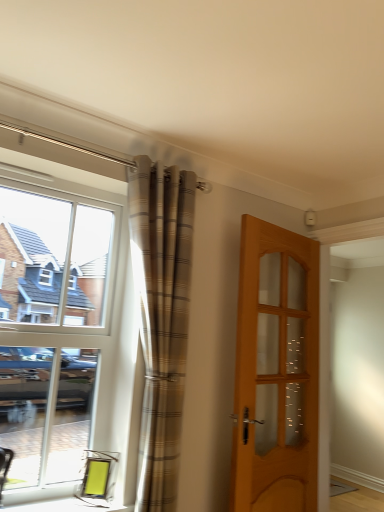
Question: From a real-world perspective, is plaid fabric curtain at left physically located above or below white glass window at left?

Choices:
 (A) below
 (B) above

Answer: (B)

Question: In terms of width, does plaid fabric curtain at left look wider or thinner when compared to white glass window at left?

Choices:
 (A) wide
 (B) thin

Answer: (A)

Question: Which is farther from the matte glass window sill at lower left?

Choices:
 (A) wooden glass door at right
 (B) white glass window at left
 (C) plaid fabric curtain at left

Answer: (A)

Question: Considering the real-world distances, which object is farthest from the plaid fabric curtain at left?

Choices:
 (A) matte glass window sill at lower left
 (B) wooden glass door at right
 (C) white glass window at left

Answer: (A)